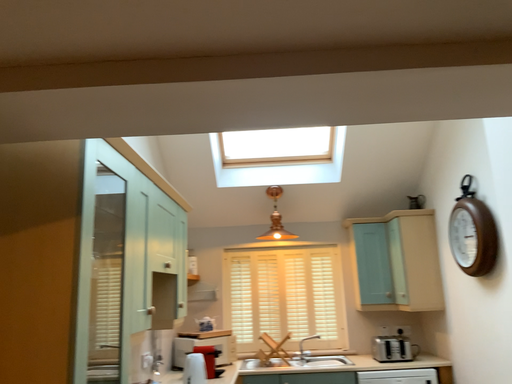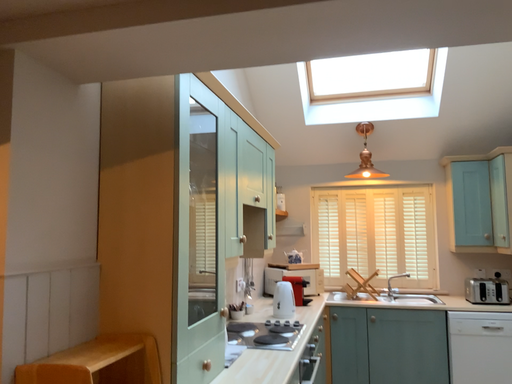
Question: Which way did the camera rotate in the video?

Choices:
 (A) rotated upward
 (B) rotated downward

Answer: (B)